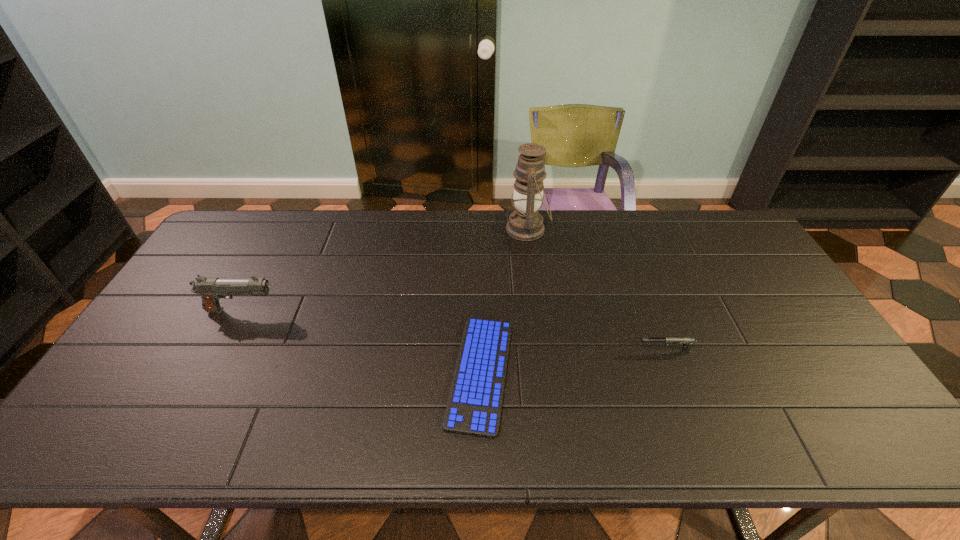
The height and width of the screenshot is (540, 960). What are the coordinates of `oil lamp` in the screenshot? It's located at (525, 223).

I want to click on the tallest object, so click(525, 223).

Identify the location of the leftmost object. The width and height of the screenshot is (960, 540). (211, 290).

Identify the location of the third shortest object. (211, 290).

You are a GUI agent. You are given a task and a screenshot of the screen. Output one action in this format:
    pyautogui.click(x=<x>, y=<y>)
    Task: Click on the third tallest object
    This screenshot has height=540, width=960.
    Given the screenshot: What is the action you would take?
    pyautogui.click(x=685, y=342)

Image resolution: width=960 pixels, height=540 pixels. In order to click on the right gun in this screenshot , I will do `click(685, 342)`.

Find the location of a particular element. Image resolution: width=960 pixels, height=540 pixels. the shortest object is located at coordinates (474, 405).

Where is `the second object from left to right`? The width and height of the screenshot is (960, 540). the second object from left to right is located at coordinates (474, 405).

Identify the location of free region located on the front of the oil lamp. This screenshot has width=960, height=540. (536, 294).

Locate an element on the screen. This screenshot has height=540, width=960. blank space located 0.190m in the direction the third nearest object is aimed is located at coordinates coord(344,310).